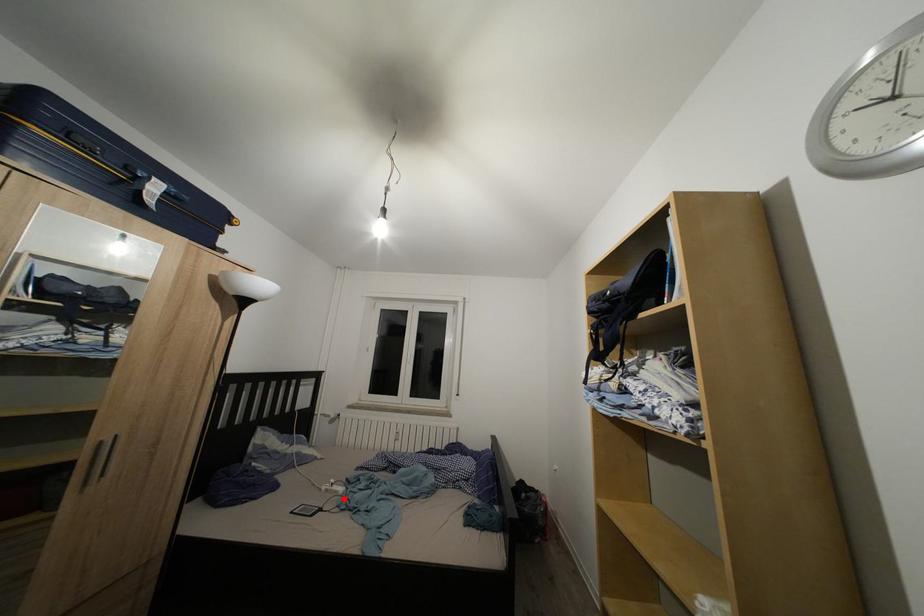
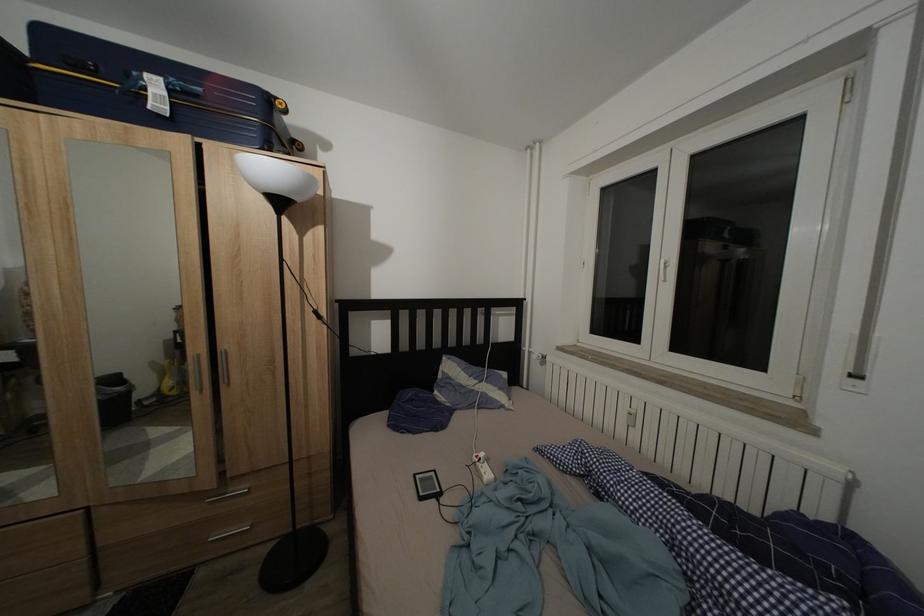
Locate, in the second image, the point that corresponds to the highlighted location in the first image.

(488, 483)